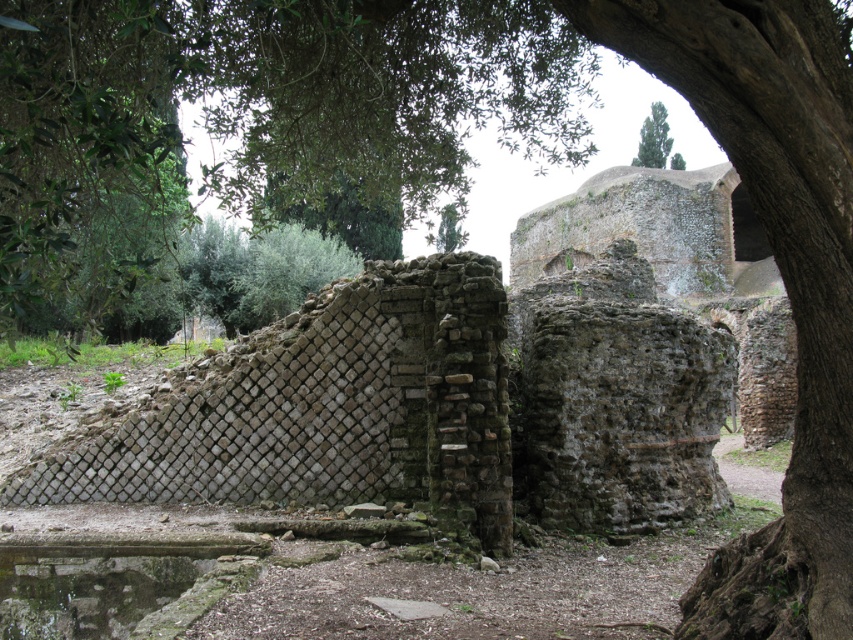
You are an archaeologist examining the site and need to mark the exact location of the green leafy tree at upper left on a grid map. What are the coordinates where you should place it?

The green leafy tree at upper left is located at coordinates point (x=260, y=113).

You are an archaeologist standing at the center of the archaeological site. You need to locate the green mossy stone at lower left. Based on your current position, in which cardinal direction should you move to find it?

The green mossy stone at lower left is located at point (109, 582), which is in the lower left quadrant of the image. Since you are at the center, you should move southwest to reach it.